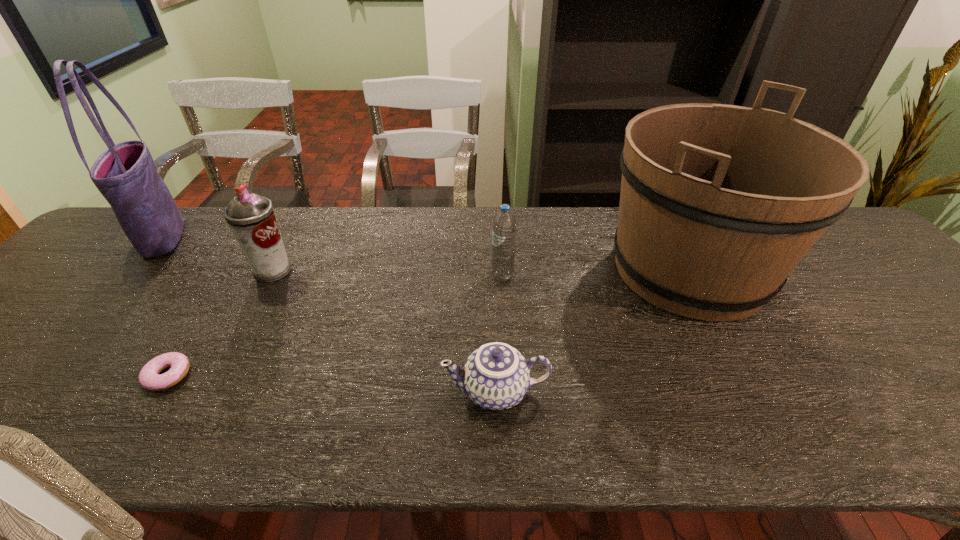
Locate an element on the screen. free space that is in between the third shortest object and the tote bag is located at coordinates (333, 256).

The height and width of the screenshot is (540, 960). I want to click on free point between the leftmost object and the aerosol can, so click(218, 254).

Locate an element on the screen. The height and width of the screenshot is (540, 960). free spot between the aerosol can and the tote bag is located at coordinates (218, 254).

The height and width of the screenshot is (540, 960). What are the coordinates of `empty space that is in between the bucket and the chinaware` in the screenshot? It's located at (592, 330).

Point out which object is positioned as the second nearest to the tote bag. Please provide its 2D coordinates. Your answer should be formatted as a tuple, i.e. [(x, y)], where the tuple contains the x and y coordinates of a point satisfying the conditions above.

[(149, 378)]

You are a GUI agent. You are given a task and a screenshot of the screen. Output one action in this format:
    pyautogui.click(x=<x>, y=<y>)
    Task: Click on the object that is the second closest to the bucket
    
    Given the screenshot: What is the action you would take?
    pyautogui.click(x=504, y=225)

Locate an element on the screen. This screenshot has width=960, height=540. free region that satisfies the following two spatial constraints: 1. on the back side of the doughnut; 2. on the left side of the third object from left to right is located at coordinates (235, 271).